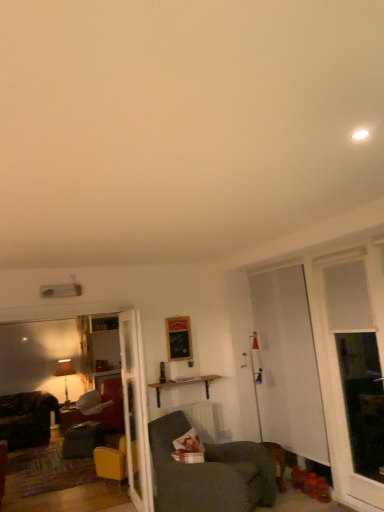
Question: Is wooden shelf at center wider than dark gray fabric chair at lower center, which is counted as the second chair, starting from the back?

Choices:
 (A) no
 (B) yes

Answer: (A)

Question: Is wooden shelf at center further to camera compared to dark gray fabric chair at lower center, the 1th chair in the top-to-bottom sequence?

Choices:
 (A) yes
 (B) no

Answer: (A)

Question: Is the surface of wooden shelf at center in direct contact with dark gray fabric chair at lower center, the 1th chair when ordered from front to back?

Choices:
 (A) no
 (B) yes

Answer: (A)

Question: From the image's perspective, is wooden shelf at center over dark gray fabric chair at lower center, the 1th chair when ordered from front to back?

Choices:
 (A) no
 (B) yes

Answer: (B)

Question: Is wooden shelf at center facing away from dark gray fabric chair at lower center, which is counted as the second chair, starting from the back?

Choices:
 (A) no
 (B) yes

Answer: (A)

Question: Is wooden shelf at center shorter than dark gray fabric chair at lower center, the 1th chair when ordered from front to back?

Choices:
 (A) no
 (B) yes

Answer: (B)

Question: From a real-world perspective, is white glossy door at center on dark gray fabric chair at lower center, which is counted as the second chair, starting from the back?

Choices:
 (A) no
 (B) yes

Answer: (B)

Question: Is white glossy door at center next to dark gray fabric chair at lower center, the 1th chair when ordered from front to back?

Choices:
 (A) yes
 (B) no

Answer: (B)

Question: From the image's perspective, is white glossy door at center under dark gray fabric chair at lower center, which is the 2th chair in left-to-right order?

Choices:
 (A) yes
 (B) no

Answer: (B)

Question: Is dark gray fabric chair at lower center, the 2th chair ordered from the bottom, located within white glossy door at center?

Choices:
 (A) no
 (B) yes

Answer: (A)

Question: Can you confirm if white glossy door at center is smaller than dark gray fabric chair at lower center, the first chair viewed from the right?

Choices:
 (A) yes
 (B) no

Answer: (A)

Question: Does white glossy door at center come behind dark gray fabric chair at lower center, the 1th chair in the top-to-bottom sequence?

Choices:
 (A) yes
 (B) no

Answer: (A)

Question: From the image's perspective, is velvet dark grey swivel chair at lower left under dark gray fabric chair at lower center, the 1th chair when ordered from front to back?

Choices:
 (A) yes
 (B) no

Answer: (A)